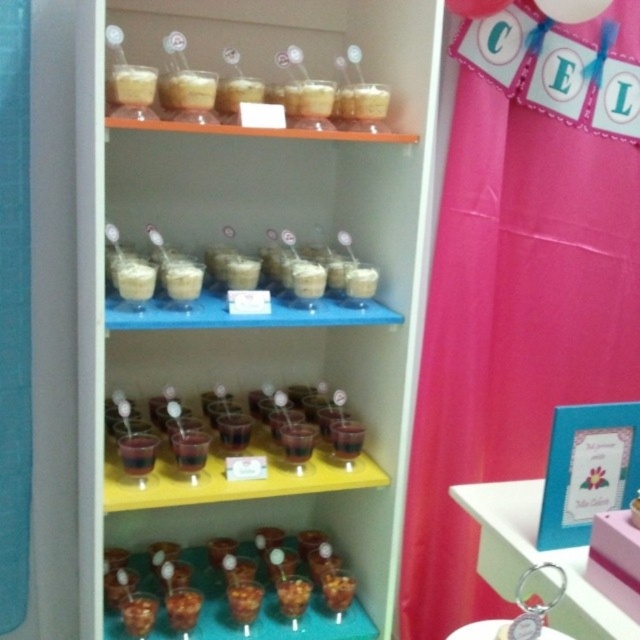
Is translucent glass cups at center to the left of pink glossy keychain at lower right from the viewer's perspective?

Yes, translucent glass cups at center is to the left of pink glossy keychain at lower right.

Can you confirm if translucent glass cups at center is shorter than pink glossy keychain at lower right?

Incorrect, translucent glass cups at center's height does not fall short of pink glossy keychain at lower right's.

The height and width of the screenshot is (640, 640). In order to click on translucent glass cups at center in this screenshot , I will do `click(260, 289)`.